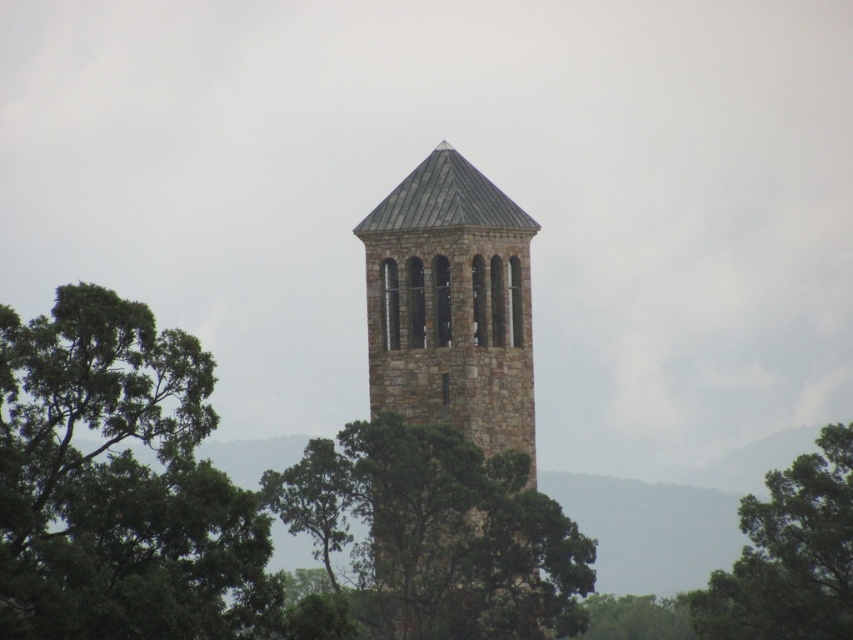
You are standing in front of the stone tower and notice two green leafy trees. One is labeled as the green leafy tree at left, and the other is the green leafy tree at lower center. Which tree is positioned higher relative to the tower?

The green leafy tree at left is located above the green leafy tree at lower center, so it is positioned higher relative to the tower.

You are standing at the center of the tower and looking towards the green leafy tree at left. What are the coordinates of the tree relative to your position?

The coordinates of the green leafy tree at left are at point (x=117, y=483) relative to the tower.